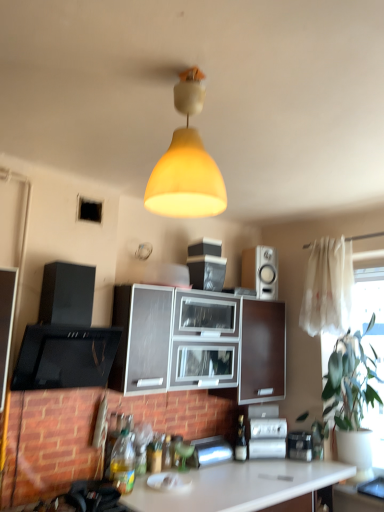
Question: Choose the correct answer: Is translucent glass bottle at center, positioned as the first bottle in back-to-front order, inside green leafy plant at right or outside it?

Choices:
 (A) inside
 (B) outside

Answer: (B)

Question: Is translucent glass bottle at center, positioned as the first bottle in back-to-front order, in front of or behind green leafy plant at right in the image?

Choices:
 (A) behind
 (B) front

Answer: (A)

Question: Which object is positioned closest to the translucent plastic bottle at lower left, the 3th bottle positioned from the right?

Choices:
 (A) metallic silver toaster at lower right, which is the first appliance in right-to-left order
 (B) yellow matte lampshade at center
 (C) translucent glass bottle at center, positioned as the first bottle in back-to-front order
 (D) white glossy countertop at lower center
 (E) green leafy plant at right

Answer: (D)

Question: Based on their relative distances, which object is nearer to the translucent glass bottle at lower center, the 2th bottle when ordered from right to left?

Choices:
 (A) metallic silver toaster at lower center, which is the 3th appliance from right to left
 (B) matte gray cabinet at center
 (C) yellow matte lampshade at center
 (D) satin silver appliance at lower center, the 2th appliance from the left
 (E) white sheer curtain at right

Answer: (A)